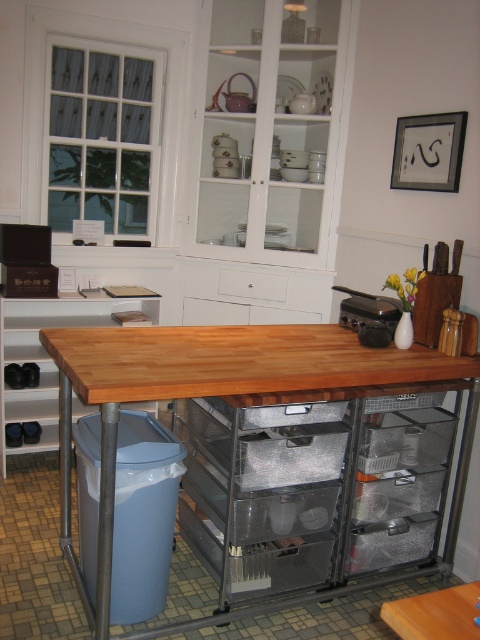
Is point (241, 29) positioned before point (111, 337)?

That is False.

Which is more to the left, white glossy cabinet at upper center or wooden table at center?

Positioned to the left is wooden table at center.

Which is behind, point (239, 97) or point (80, 593)?

The point (239, 97) is behind.

I want to click on white glossy cabinet at upper center, so click(x=268, y=131).